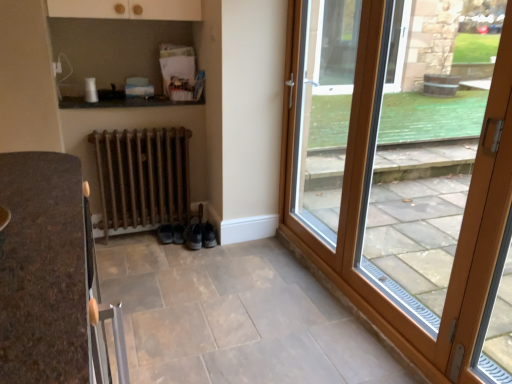
Describe the element at coordinates (142, 177) in the screenshot. I see `rusty metal radiator at lower center` at that location.

Image resolution: width=512 pixels, height=384 pixels. Find the location of `rusty metal radiator at lower center`. rusty metal radiator at lower center is located at coordinates (142, 177).

You are a GUI agent. You are given a task and a screenshot of the screen. Output one action in this format:
    pyautogui.click(x=<x>, y=<y>)
    Task: Click on the leather black shoe at lower center, marked as the first shoe in a right-to-left arrangement
    
    Given the screenshot: What is the action you would take?
    pyautogui.click(x=193, y=236)

This screenshot has height=384, width=512. Find the location of `black suede shoe at lower center, the 1th shoe when ordered from left to right`. black suede shoe at lower center, the 1th shoe when ordered from left to right is located at coordinates (165, 233).

Identify the location of wooden glass door at right, the first door positioned from the left. click(x=405, y=167).

Can you tell me how much wooden door at right, which is the 1th door from right to left, and black suede shoe at lower center, acting as the 2th shoe starting from the right, differ in facing direction?

90.7 degrees separate the facing orientations of wooden door at right, which is the 1th door from right to left, and black suede shoe at lower center, acting as the 2th shoe starting from the right.

Who is taller, wooden door at right, which is the 1th door from right to left, or black suede shoe at lower center, acting as the 2th shoe starting from the right?

wooden door at right, which is the 1th door from right to left, is taller.

From the image's perspective, relative to black suede shoe at lower center, the 1th shoe when ordered from left to right, is wooden door at right, which is the 1th door from right to left, above or below?

wooden door at right, which is the 1th door from right to left, is above black suede shoe at lower center, the 1th shoe when ordered from left to right.

From a real-world perspective, count 2nd shoes downward from the wooden glass door at right, the 2th door in the right-to-left sequence, and point to it. Please provide its 2D coordinates.

[(165, 233)]

Can you confirm if black suede shoe at lower center, the 1th shoe when ordered from left to right, is positioned to the right of wooden glass door at right, the first door positioned from the left?

No.

Considering the relative sizes of black suede shoe at lower center, the 1th shoe when ordered from left to right, and wooden glass door at right, the first door positioned from the left, in the image provided, is black suede shoe at lower center, the 1th shoe when ordered from left to right, shorter than wooden glass door at right, the first door positioned from the left,?

Indeed, black suede shoe at lower center, the 1th shoe when ordered from left to right, has a lesser height compared to wooden glass door at right, the first door positioned from the left.

Measure the distance between black suede shoe at lower center, acting as the 2th shoe starting from the right, and wooden glass door at right, the 2th door in the right-to-left sequence.

black suede shoe at lower center, acting as the 2th shoe starting from the right, is 5.80 feet away from wooden glass door at right, the 2th door in the right-to-left sequence.

From the picture: From the image's perspective, is leather black shoe at lower center, which is the 2th shoe in left-to-right order, above black suede shoe at lower center, the 1th shoe when ordered from left to right?

Yes, from the image's perspective, leather black shoe at lower center, which is the 2th shoe in left-to-right order, is over black suede shoe at lower center, the 1th shoe when ordered from left to right.

Are leather black shoe at lower center, which is the 2th shoe in left-to-right order, and black suede shoe at lower center, the 1th shoe when ordered from left to right, beside each other?

No, leather black shoe at lower center, which is the 2th shoe in left-to-right order, is not beside black suede shoe at lower center, the 1th shoe when ordered from left to right.

Is leather black shoe at lower center, marked as the first shoe in a right-to-left arrangement, in front of black suede shoe at lower center, the 1th shoe when ordered from left to right?

Yes, leather black shoe at lower center, marked as the first shoe in a right-to-left arrangement, is closer to the viewer.

Which of these two, leather black shoe at lower center, which is the 2th shoe in left-to-right order, or black suede shoe at lower center, the 1th shoe when ordered from left to right, is thinner?

black suede shoe at lower center, the 1th shoe when ordered from left to right, is thinner.

Can you tell me how much wooden door at right, which is the 1th door from right to left, and leather black shoe at lower center, which is the 2th shoe in left-to-right order, differ in facing direction?

90.7 degrees.

Is wooden door at right, which is the 1th door from right to left, positioned before leather black shoe at lower center, which is the 2th shoe in left-to-right order?

Yes, wooden door at right, which is the 1th door from right to left, is in front of leather black shoe at lower center, which is the 2th shoe in left-to-right order.

Is wooden door at right, which is the 1th door from right to left, positioned far away from leather black shoe at lower center, marked as the first shoe in a right-to-left arrangement?

Yes, wooden door at right, which is the 1th door from right to left, is far from leather black shoe at lower center, marked as the first shoe in a right-to-left arrangement.

From the image's perspective, between wooden door at right, which ranks as the second door in left-to-right order, and leather black shoe at lower center, marked as the first shoe in a right-to-left arrangement, who is located below?

leather black shoe at lower center, marked as the first shoe in a right-to-left arrangement.

Could you tell me if black suede shoe at lower center, the 1th shoe when ordered from left to right, is turned towards wooden door at right, which ranks as the second door in left-to-right order?

No, black suede shoe at lower center, the 1th shoe when ordered from left to right, is not oriented towards wooden door at right, which ranks as the second door in left-to-right order.

From the picture: From a real-world perspective, which object rests below the other?

In real-world perspective, black suede shoe at lower center, acting as the 2th shoe starting from the right, is lower.

Does black suede shoe at lower center, acting as the 2th shoe starting from the right, touch wooden door at right, which ranks as the second door in left-to-right order?

There is a gap between black suede shoe at lower center, acting as the 2th shoe starting from the right, and wooden door at right, which ranks as the second door in left-to-right order.

Is black suede shoe at lower center, acting as the 2th shoe starting from the right, positioned beyond the bounds of wooden door at right, which ranks as the second door in left-to-right order?

black suede shoe at lower center, acting as the 2th shoe starting from the right, is positioned outside wooden door at right, which ranks as the second door in left-to-right order.

Are wooden door at right, which is the 1th door from right to left, and rusty metal radiator at lower center beside each other?

There is a gap between wooden door at right, which is the 1th door from right to left, and rusty metal radiator at lower center.

Does wooden door at right, which is the 1th door from right to left, have a smaller size compared to rusty metal radiator at lower center?

Yes, wooden door at right, which is the 1th door from right to left, is smaller than rusty metal radiator at lower center.

Considering the sizes of objects wooden door at right, which ranks as the second door in left-to-right order, and rusty metal radiator at lower center in the image provided, who is shorter, wooden door at right, which ranks as the second door in left-to-right order, or rusty metal radiator at lower center?

With less height is rusty metal radiator at lower center.

Which point is more distant from viewer, (468, 340) or (168, 204)?

The point (168, 204) is farther.

Considering the positions of objects leather black shoe at lower center, marked as the first shoe in a right-to-left arrangement, and wooden door at right, which ranks as the second door in left-to-right order, in the image provided, who is more to the left, leather black shoe at lower center, marked as the first shoe in a right-to-left arrangement, or wooden door at right, which ranks as the second door in left-to-right order,?

leather black shoe at lower center, marked as the first shoe in a right-to-left arrangement.

Which point is more distant from viewer, (189, 229) or (502, 236)?

The point (189, 229) is farther from the camera.

Measure the distance from leather black shoe at lower center, which is the 2th shoe in left-to-right order, to wooden door at right, which ranks as the second door in left-to-right order.

leather black shoe at lower center, which is the 2th shoe in left-to-right order, and wooden door at right, which ranks as the second door in left-to-right order, are 1.79 meters apart.

In the scene shown: Is leather black shoe at lower center, marked as the first shoe in a right-to-left arrangement, not within wooden door at right, which ranks as the second door in left-to-right order?

Yes, leather black shoe at lower center, marked as the first shoe in a right-to-left arrangement, is located beyond the bounds of wooden door at right, which ranks as the second door in left-to-right order.

Starting from the black suede shoe at lower center, acting as the 2th shoe starting from the right, which door is the 2nd one to the right? Please provide its 2D coordinates.

[(488, 225)]

From the image's perspective, which shoe is the 2nd one below the wooden glass door at right, the first door positioned from the left? Please provide its 2D coordinates.

[(165, 233)]

Considering their positions, is wooden glass door at right, the 2th door in the right-to-left sequence, positioned closer to black suede shoe at lower center, acting as the 2th shoe starting from the right, than rusty metal radiator at lower center?

rusty metal radiator at lower center.

From the image, which object appears to be farther from wooden glass door at right, the 2th door in the right-to-left sequence, black suede shoe at lower center, acting as the 2th shoe starting from the right, or leather black shoe at lower center, which is the 2th shoe in left-to-right order?

Among the two, black suede shoe at lower center, acting as the 2th shoe starting from the right, is located further to wooden glass door at right, the 2th door in the right-to-left sequence.

From the image, which object appears to be farther from wooden glass door at right, the first door positioned from the left, leather black shoe at lower center, which is the 2th shoe in left-to-right order, or wooden door at right, which is the 1th door from right to left?

leather black shoe at lower center, which is the 2th shoe in left-to-right order, lies further to wooden glass door at right, the first door positioned from the left, than the other object.

When comparing their distances from wooden door at right, which ranks as the second door in left-to-right order, does black suede shoe at lower center, acting as the 2th shoe starting from the right, or wooden glass door at right, the 2th door in the right-to-left sequence, seem closer?

The object closer to wooden door at right, which ranks as the second door in left-to-right order, is wooden glass door at right, the 2th door in the right-to-left sequence.

When comparing their distances from black suede shoe at lower center, the 1th shoe when ordered from left to right, does leather black shoe at lower center, which is the 2th shoe in left-to-right order, or wooden door at right, which is the 1th door from right to left, seem further?

wooden door at right, which is the 1th door from right to left, lies further to black suede shoe at lower center, the 1th shoe when ordered from left to right, than the other object.

Looking at the image, which one is located closer to wooden glass door at right, the 2th door in the right-to-left sequence, wooden door at right, which is the 1th door from right to left, or black suede shoe at lower center, acting as the 2th shoe starting from the right?

The object closer to wooden glass door at right, the 2th door in the right-to-left sequence, is wooden door at right, which is the 1th door from right to left.

Estimate the real-world distances between objects in this image. Which object is further from wooden glass door at right, the 2th door in the right-to-left sequence, leather black shoe at lower center, marked as the first shoe in a right-to-left arrangement, or black suede shoe at lower center, the 1th shoe when ordered from left to right?

The object further to wooden glass door at right, the 2th door in the right-to-left sequence, is black suede shoe at lower center, the 1th shoe when ordered from left to right.

Which object lies further to the anchor point leather black shoe at lower center, marked as the first shoe in a right-to-left arrangement, black suede shoe at lower center, the 1th shoe when ordered from left to right, or rusty metal radiator at lower center?

rusty metal radiator at lower center.

Identify the location of radiator between wooden door at right, which is the 1th door from right to left, and leather black shoe at lower center, which is the 2th shoe in left-to-right order, from front to back. This screenshot has height=384, width=512. (142, 177).

The image size is (512, 384). I want to click on door located between wooden glass door at right, the 2th door in the right-to-left sequence, and leather black shoe at lower center, which is the 2th shoe in left-to-right order, in the depth direction, so click(488, 225).

This screenshot has height=384, width=512. I want to click on shoe located between wooden glass door at right, the 2th door in the right-to-left sequence, and black suede shoe at lower center, the 1th shoe when ordered from left to right, in the depth direction, so click(193, 236).

Locate an element on the screen. This screenshot has height=384, width=512. door positioned between wooden glass door at right, the 2th door in the right-to-left sequence, and black suede shoe at lower center, acting as the 2th shoe starting from the right, from near to far is located at coordinates (488, 225).